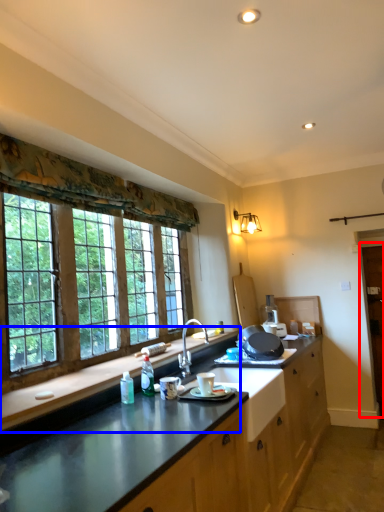
Question: Among these objects, which one is nearest to the camera, barn door (highlighted by a red box) or countertop (highlighted by a blue box)?

Choices:
 (A) barn door
 (B) countertop

Answer: (B)